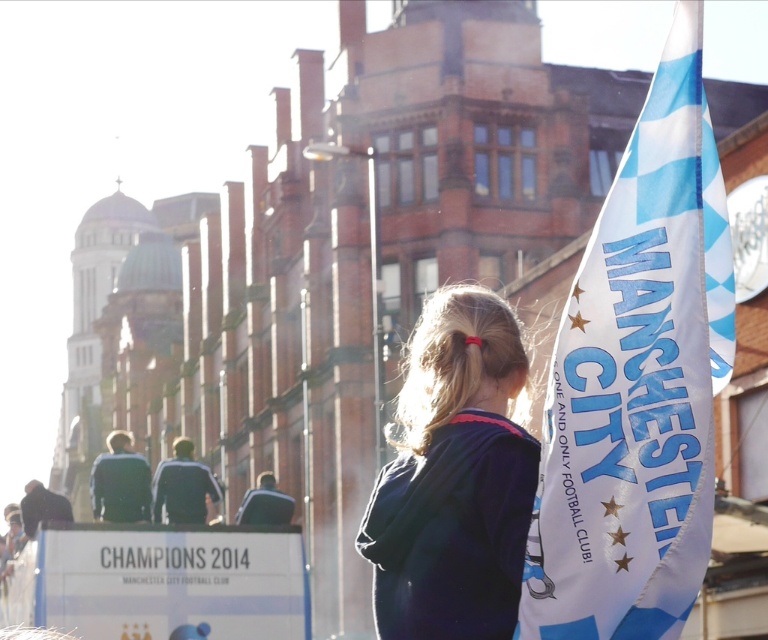
You are a photographer at the event and want to capture a photo of the dark blue sweater at center and the white fabric manchester city flag at right. Which object is taller?

The white fabric manchester city flag at right is much taller than the dark blue sweater at center.